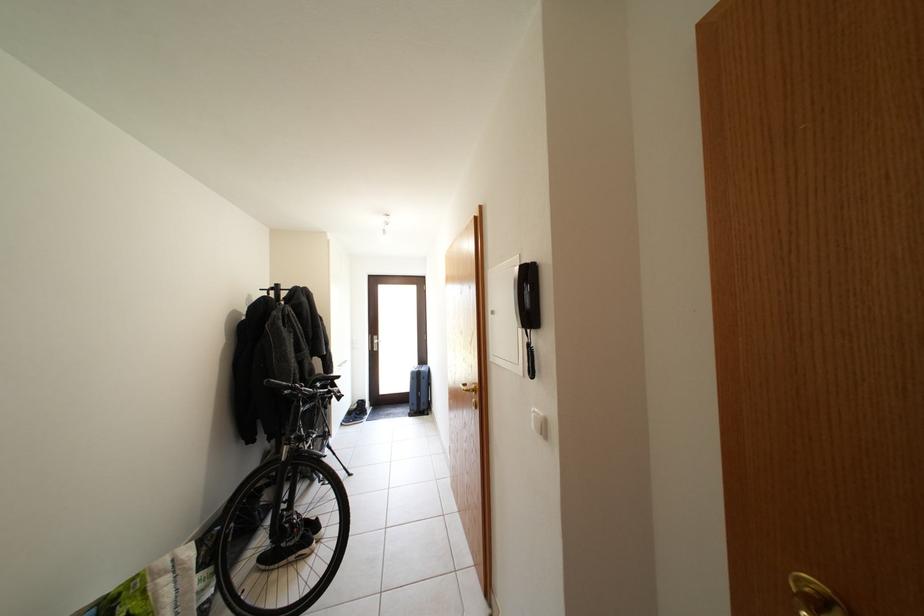
Identify the location of black coat rack post. (274, 291).